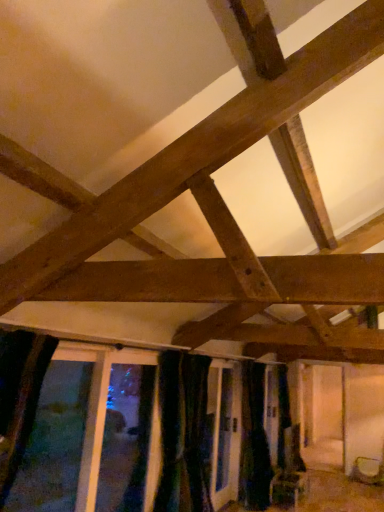
Where is `matte brown basket at lower right`? The height and width of the screenshot is (512, 384). matte brown basket at lower right is located at coordinates (368, 471).

Where is `transparent glass window at lower left`? This screenshot has height=512, width=384. transparent glass window at lower left is located at coordinates (54, 442).

Find the location of a particular element. black fabric curtain at lower center is located at coordinates (254, 440).

You are a GUI agent. You are given a task and a screenshot of the screen. Output one action in this format:
    pyautogui.click(x=<x>, y=<y>)
    Task: Click on the matte brown basket at lower right
    
    Given the screenshot: What is the action you would take?
    pyautogui.click(x=368, y=471)

Considering the points (77, 439) and (252, 451), which point is in front, point (77, 439) or point (252, 451)?

The point (77, 439) is closer.

The width and height of the screenshot is (384, 512). In the image, there is a black fabric curtain at lower center. What are the coordinates of `window above it (from the image's perspective)` in the screenshot? It's located at (54, 442).

Is transparent glass window at lower left oriented away from black fabric curtain at lower center?

No, transparent glass window at lower left is not facing the opposite direction of black fabric curtain at lower center.

From the image's perspective, is transparent glass window at lower left below black fabric curtain at lower center?

Actually, transparent glass window at lower left appears above black fabric curtain at lower center in the image.

Is matte brown basket at lower right not near transparent glass window at lower left?

Yes, matte brown basket at lower right is far from transparent glass window at lower left.

Does matte brown basket at lower right turn towards transparent glass window at lower left?

Yes, matte brown basket at lower right faces towards transparent glass window at lower left.

Do you think matte brown basket at lower right is within transparent glass window at lower left, or outside of it?

matte brown basket at lower right is outside transparent glass window at lower left.

From the image's perspective, who appears lower, matte brown basket at lower right or transparent glass window at lower left?

matte brown basket at lower right.

From a real-world perspective, is black fabric curtain at lower center positioned under transparent glass window at lower left based on gravity?

Yes, from a real-world perspective, black fabric curtain at lower center is under transparent glass window at lower left.

Is black fabric curtain at lower center aimed at transparent glass window at lower left?

No, black fabric curtain at lower center is not facing towards transparent glass window at lower left.

Between point (253, 425) and point (67, 364), which one is positioned in front?

The point (67, 364) is in front.

From the image's perspective, is black fabric curtain at lower center on top of transparent glass window at lower left?

Actually, black fabric curtain at lower center appears below transparent glass window at lower left in the image.

From the picture: From a real-world perspective, is transparent glass window at lower left located beneath matte brown basket at lower right?

Actually, transparent glass window at lower left is physically above matte brown basket at lower right in the real world.

Is transparent glass window at lower left far from matte brown basket at lower right?

Yes, transparent glass window at lower left and matte brown basket at lower right are quite far apart.

Image resolution: width=384 pixels, height=512 pixels. Find the location of `furniture located on the right of transparent glass window at lower left`. furniture located on the right of transparent glass window at lower left is located at coordinates (368, 471).

Is black fabric curtain at lower center thinner than matte brown basket at lower right?

Indeed, black fabric curtain at lower center has a lesser width compared to matte brown basket at lower right.

Does black fabric curtain at lower center appear on the left side of matte brown basket at lower right?

Indeed, black fabric curtain at lower center is positioned on the left side of matte brown basket at lower right.

Is point (254, 421) farther from viewer compared to point (368, 466)?

Yes, point (254, 421) is behind point (368, 466).

Is black fabric curtain at lower center inside the boundaries of matte brown basket at lower right, or outside?

black fabric curtain at lower center is outside matte brown basket at lower right.

Based on the photo, in terms of width, does matte brown basket at lower right look wider or thinner when compared to black fabric curtain at lower center?

matte brown basket at lower right is wider than black fabric curtain at lower center.

Is point (353, 469) positioned behind point (242, 444)?

That is False.

In the scene shown: Which object is positioned more to the left, matte brown basket at lower right or black fabric curtain at lower center?

black fabric curtain at lower center.

The height and width of the screenshot is (512, 384). In the image, there is a transparent glass window at lower left. Find the location of `curtain below it (from a real-world perspective)`. curtain below it (from a real-world perspective) is located at coordinates (254, 440).

In the image, there is a transparent glass window at lower left. Where is `furniture below it (from the image's perspective)`? This screenshot has width=384, height=512. furniture below it (from the image's perspective) is located at coordinates (368, 471).

Based on their spatial positions, is transparent glass window at lower left or black fabric curtain at lower center further from matte brown basket at lower right?

Among the two, transparent glass window at lower left is located further to matte brown basket at lower right.

From the image, which object appears to be nearer to black fabric curtain at lower center, transparent glass window at lower left or matte brown basket at lower right?

matte brown basket at lower right is positioned closer to the anchor black fabric curtain at lower center.

Estimate the real-world distances between objects in this image. Which object is further from transparent glass window at lower left, black fabric curtain at lower center or matte brown basket at lower right?

matte brown basket at lower right lies further to transparent glass window at lower left than the other object.

Looking at the image, which one is located further to black fabric curtain at lower center, matte brown basket at lower right or transparent glass window at lower left?

Based on the image, transparent glass window at lower left appears to be further to black fabric curtain at lower center.

Considering their positions, is black fabric curtain at lower center positioned further to matte brown basket at lower right than transparent glass window at lower left?

transparent glass window at lower left is further to matte brown basket at lower right.

Which object lies further to the anchor point transparent glass window at lower left, matte brown basket at lower right or black fabric curtain at lower center?

The object further to transparent glass window at lower left is matte brown basket at lower right.

Find the location of a particular element. The width and height of the screenshot is (384, 512). curtain between transparent glass window at lower left and matte brown basket at lower right in the front-back direction is located at coordinates (254, 440).